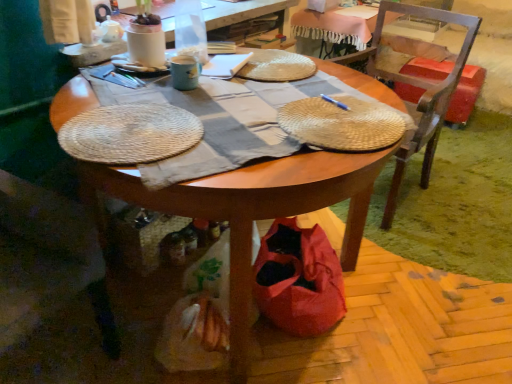
The image size is (512, 384). Find the location of `free point in front of red plastic trash can at right`. free point in front of red plastic trash can at right is located at coordinates (471, 139).